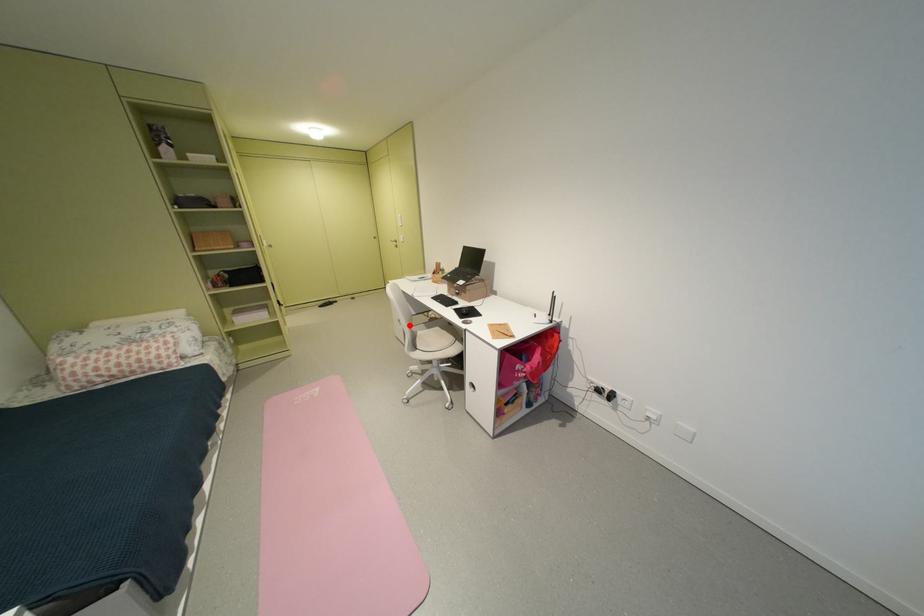
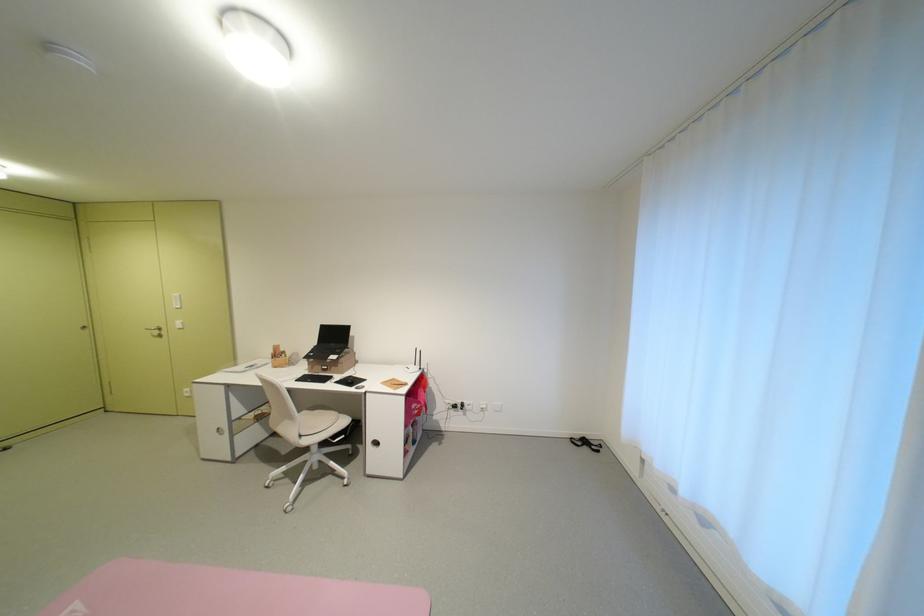
Question: I am providing you with two images of the same scene from different viewpoints. In image1, a red point is highlighted. Considering the same 3D point in image2, which of the following is correct?

Choices:
 (A) It is closer
 (B) It is farther

Answer: (A)